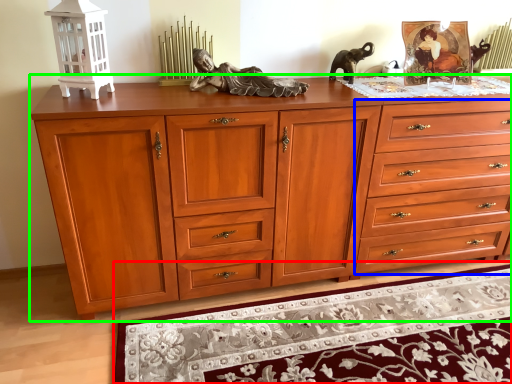
Question: Estimate the real-world distances between objects in this image. Which object is farther from mat (highlighted by a red box), drawer (highlighted by a blue box) or chest of drawers (highlighted by a green box)?

Choices:
 (A) drawer
 (B) chest of drawers

Answer: (A)